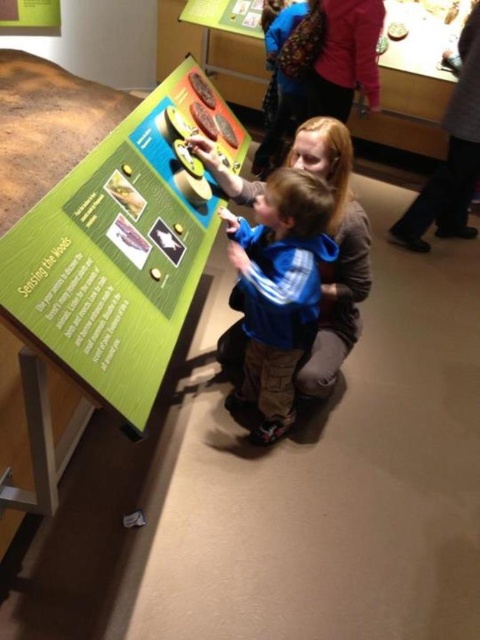
This screenshot has width=480, height=640. Identify the location of green matte board at center. (120, 248).